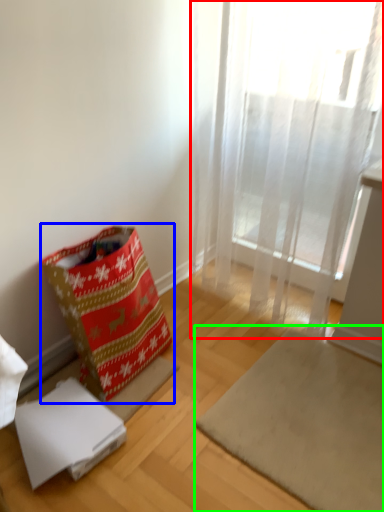
Question: Based on their relative distances, which object is nearer to curtain (highlighted by a red box)? Choose from gift bag (highlighted by a blue box) and mat (highlighted by a green box).

Choices:
 (A) gift bag
 (B) mat

Answer: (B)